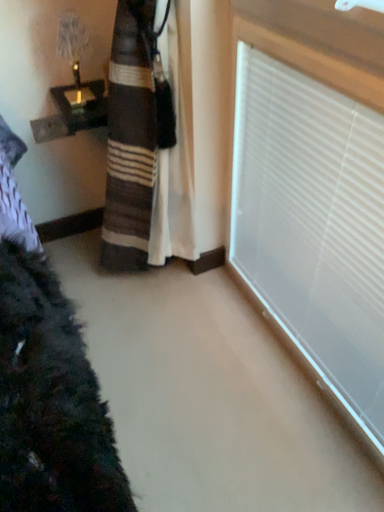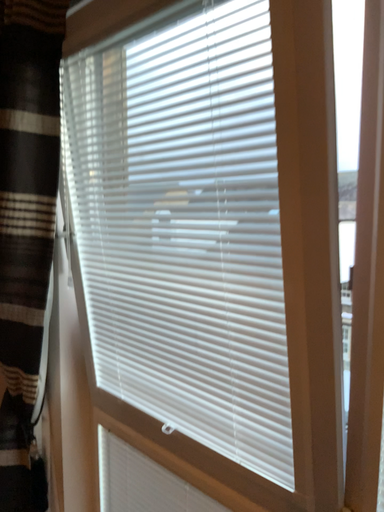
Question: Which way did the camera rotate in the video?

Choices:
 (A) rotated downward
 (B) rotated upward

Answer: (B)